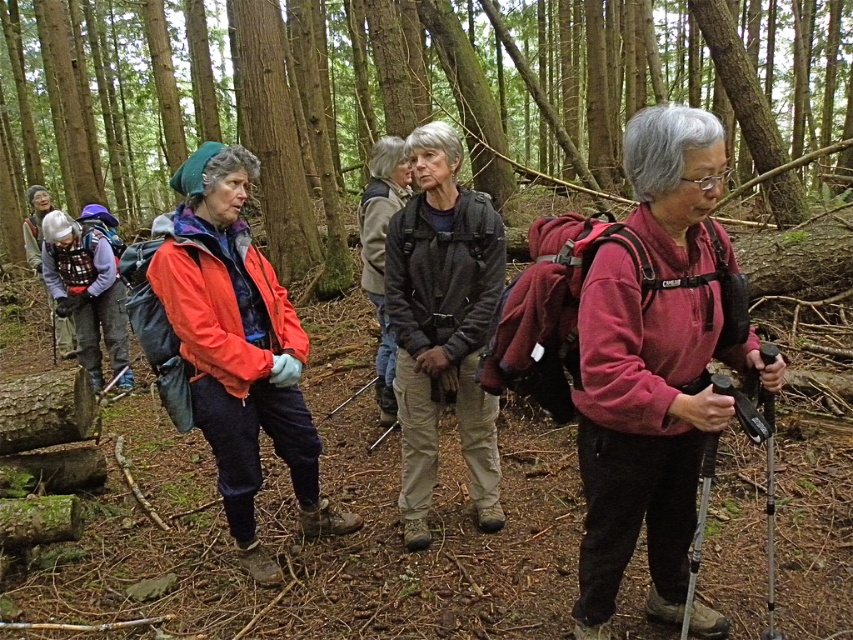
Is brown wood tree at center taller than matte pink sweater at center?

Correct, brown wood tree at center is much taller as matte pink sweater at center.

Is point (282, 280) farther from viewer compared to point (721, 152)?

Yes, it is behind point (721, 152).

Locate an element on the screen. brown wood tree at center is located at coordinates (415, 102).

Is the position of brown wood tree at center more distant than that of dark gray textured jacket at center?

Yes, brown wood tree at center is further from the viewer.

Measure the distance between brown wood tree at center and camera.

brown wood tree at center is 5.36 meters away from camera.

This screenshot has width=853, height=640. I want to click on brown wood tree at center, so click(x=415, y=102).

Is matte pink sweater at center shorter than dark gray textured jacket at center?

Correct, matte pink sweater at center is not as tall as dark gray textured jacket at center.

Who is taller, matte pink sweater at center or dark gray textured jacket at center?

dark gray textured jacket at center is taller.

Find the location of a particular element. The height and width of the screenshot is (640, 853). matte pink sweater at center is located at coordinates (653, 368).

Find the location of a particular element. matte pink sweater at center is located at coordinates (653, 368).